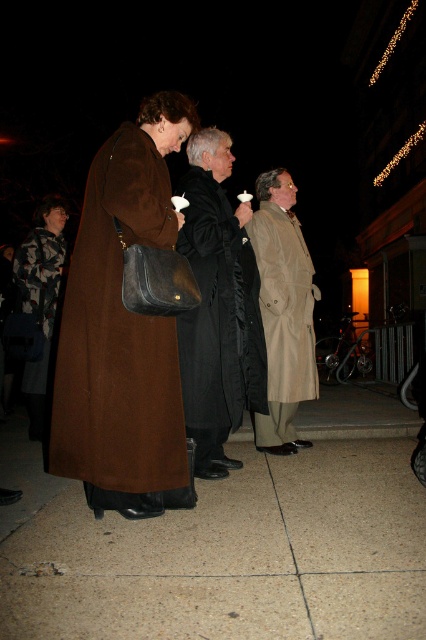
Question: Which point is closer to the camera?

Choices:
 (A) tan leather coat at center
 (B) camouflage fabric jacket at lower left
 (C) brown wool coat at left

Answer: (C)

Question: Does brown polished stone pavement at center appear on the right side of tan leather coat at center?

Choices:
 (A) no
 (B) yes

Answer: (A)

Question: Which of the following is the closest to the observer?

Choices:
 (A) brown polished stone pavement at center
 (B) camouflage fabric jacket at lower left
 (C) brown wool coat at left
 (D) tan leather coat at center

Answer: (A)

Question: Is the position of brown wool coat at left less distant than that of camouflage fabric jacket at lower left?

Choices:
 (A) no
 (B) yes

Answer: (B)

Question: Is brown polished stone pavement at center positioned before brown wool coat at left?

Choices:
 (A) no
 (B) yes

Answer: (B)

Question: Which object appears closest to the camera in this image?

Choices:
 (A) black wool coat at center
 (B) brown wool coat at left
 (C) camouflage fabric jacket at lower left

Answer: (B)